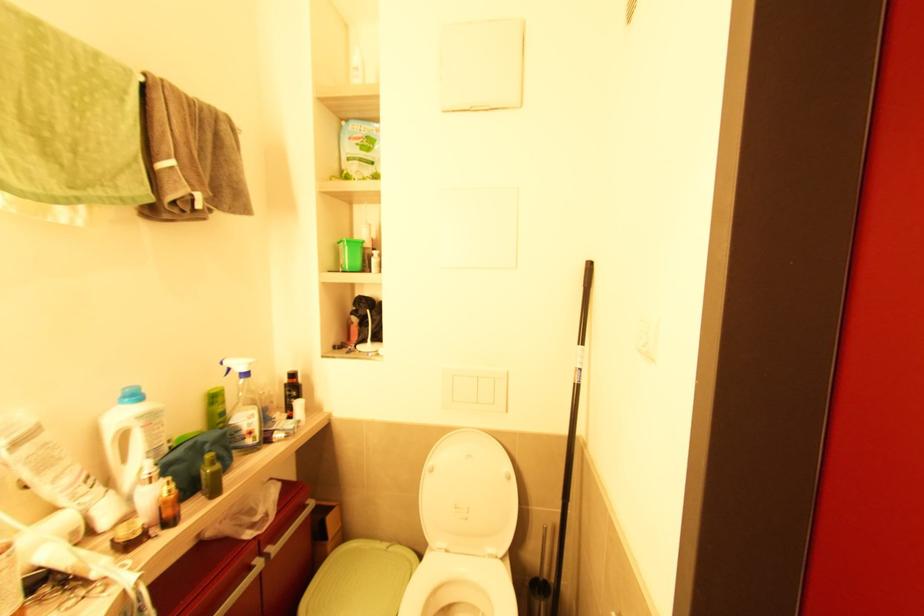
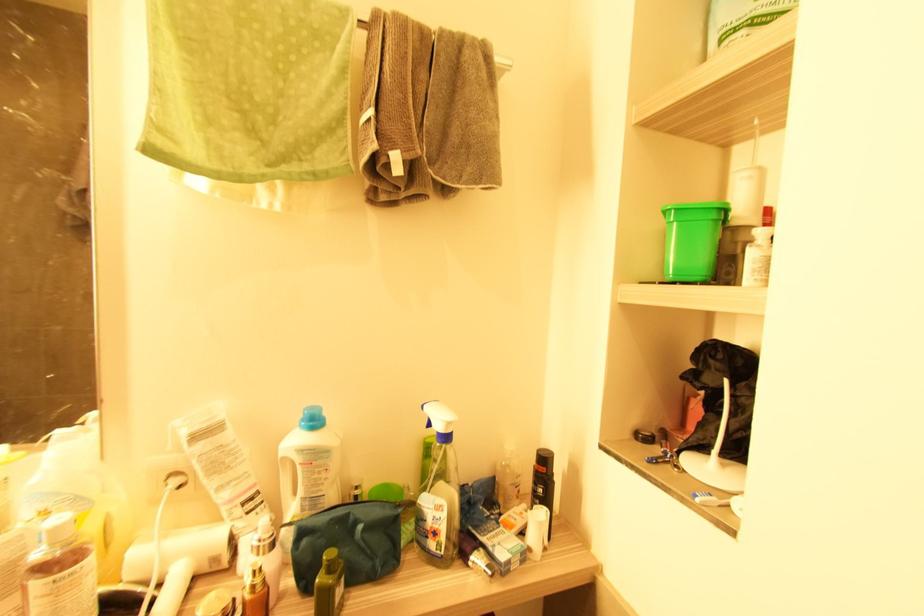
Find the pixel in the second image that matches [377,257] in the first image.

(760, 246)